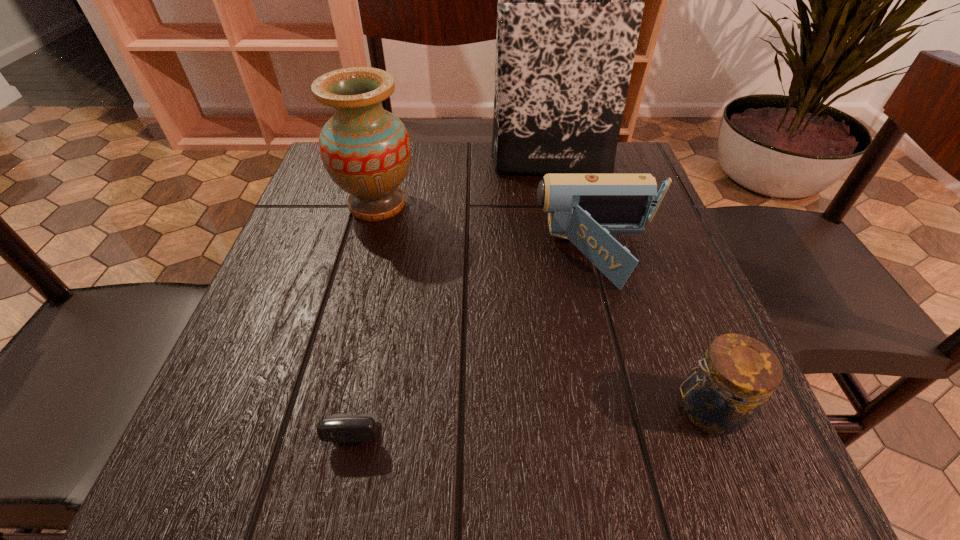
The image size is (960, 540). Identify the location of webcam located in the left edge section of the desktop. (344, 428).

This screenshot has width=960, height=540. I want to click on shopping bag at the right edge, so click(569, 11).

In order to click on camcorder present at the right edge in this screenshot , I will do `click(585, 208)`.

This screenshot has height=540, width=960. Find the location of `jar located in the right edge section of the desktop`. jar located in the right edge section of the desktop is located at coordinates (725, 390).

Where is `object at the far left corner`? Image resolution: width=960 pixels, height=540 pixels. object at the far left corner is located at coordinates (366, 150).

Identify the location of object situated at the near left corner. The height and width of the screenshot is (540, 960). (344, 428).

Where is `object that is at the far right corner`? The image size is (960, 540). object that is at the far right corner is located at coordinates (569, 11).

The image size is (960, 540). What are the coordinates of `object at the near right corner` in the screenshot? It's located at (725, 390).

Where is `free space at the far edge of the desktop`? free space at the far edge of the desktop is located at coordinates (462, 167).

Locate an element on the screen. free spot at the near edge of the desktop is located at coordinates (459, 489).